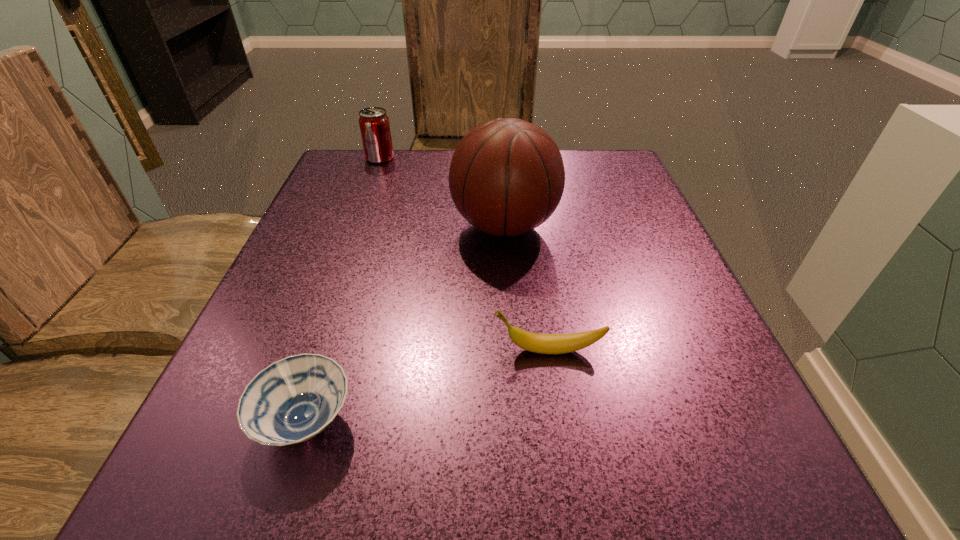
The image size is (960, 540). In order to click on object that is at the near left corner in this screenshot , I will do `click(292, 400)`.

Locate an element on the screen. The width and height of the screenshot is (960, 540). free space at the near edge of the desktop is located at coordinates (309, 510).

In order to click on vacant space at the left edge of the desktop in this screenshot , I will do `click(300, 310)`.

You are a GUI agent. You are given a task and a screenshot of the screen. Output one action in this format:
    pyautogui.click(x=<x>, y=<y>)
    Task: Click on the vacant space at the right edge of the desktop
    The image size is (960, 540).
    Given the screenshot: What is the action you would take?
    pyautogui.click(x=595, y=223)

The height and width of the screenshot is (540, 960). What are the coordinates of `vacant region at the far left corner of the desktop` in the screenshot? It's located at (355, 165).

At what (x,y) coordinates should I click in order to perform the action: click on free space at the far right corner of the desktop. Please return your answer as a coordinate pair (x, y). Image resolution: width=960 pixels, height=540 pixels. Looking at the image, I should click on (639, 197).

This screenshot has width=960, height=540. I want to click on free space between the tallest object and the banana, so click(526, 288).

The width and height of the screenshot is (960, 540). I want to click on free point between the soup bowl and the banana, so click(427, 386).

I want to click on vacant area that lies between the farthest object and the third farthest object, so click(464, 254).

You are a GUI agent. You are given a task and a screenshot of the screen. Output one action in this format:
    pyautogui.click(x=<x>, y=<y>)
    Task: Click on the free space between the shortest object and the second tallest object
    This screenshot has height=540, width=960.
    Given the screenshot: What is the action you would take?
    pyautogui.click(x=343, y=289)